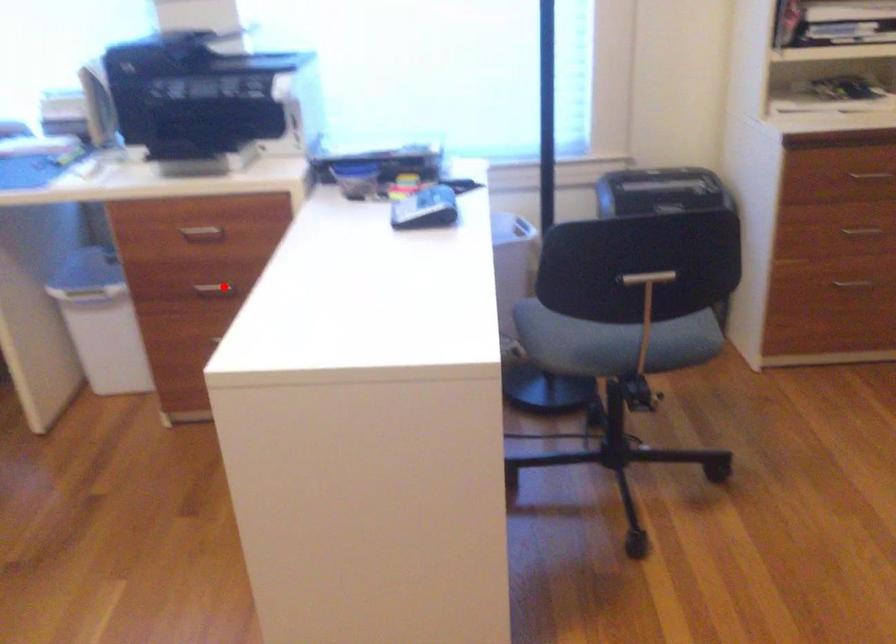
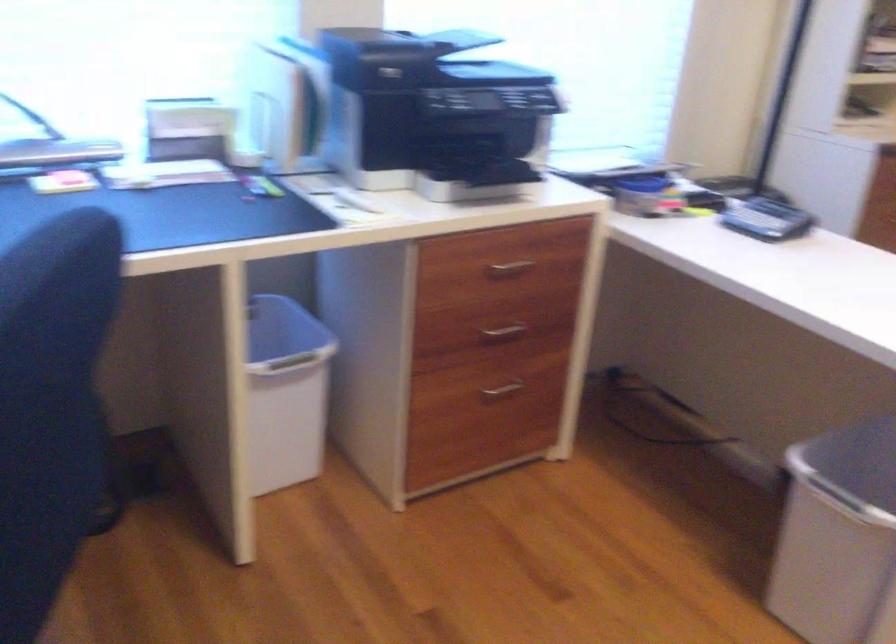
Question: I am providing you with two images of the same scene from different viewpoints. In image1, a red point is highlighted. Considering the same 3D point in image2, which of the following is correct?

Choices:
 (A) It is closer
 (B) It is farther

Answer: (A)